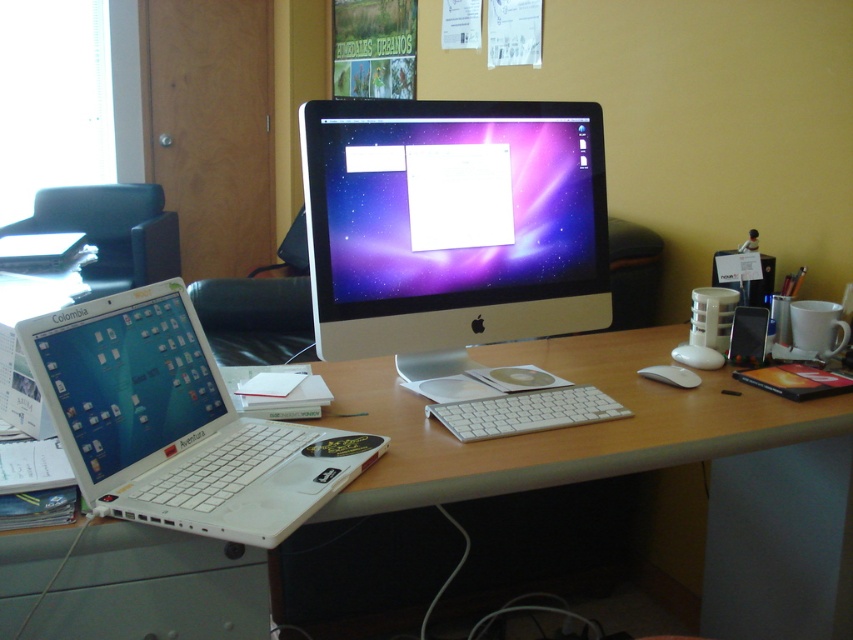
You are organizing the desk and want to place a new keyboard between the silver metallic monitor at center and the white plastic computer desk at center. Which object should the keyboard be placed closer to if you want it to be closer to the front of the desk?

The keyboard should be placed closer to the silver metallic monitor at center because the white plastic computer desk at center is behind it, meaning the monitor is positioned in front of the desk.

You are setting up a new monitor stand that requires the monitor to be taller than the desk. Based on the scene, can the silver metallic monitor at center be placed on the white plastic computer desk at center without violating the stand requirements?

The silver metallic monitor at center has a greater height compared to the white plastic computer desk at center, so placing it on the desk would violate the stand requirements since the monitor is taller than the desk.

You are organizing the desk and want to place a new wireless mouse between the white glossy laptop at lower left and the white plastic keyboard at center. Based on their positions, which side of the keyboard should you place the mouse so it is closer to the laptop?

The white glossy laptop at lower left is to the left of the white plastic keyboard at center, so placing the mouse to the left side of the keyboard would position it closer to the laptop.